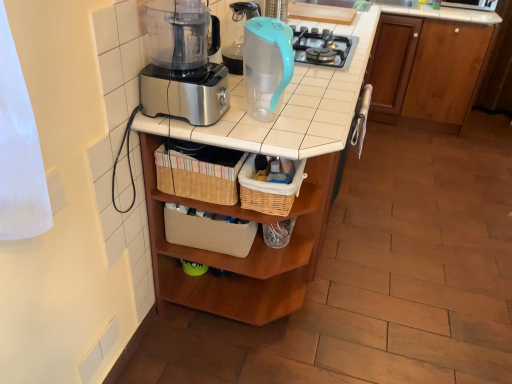
Question: Considering the relative sizes of woven straw basket at center, arranged as the second basket when viewed from the right, and teal plastic pitcher at upper center in the image provided, is woven straw basket at center, arranged as the second basket when viewed from the right, shorter than teal plastic pitcher at upper center?

Choices:
 (A) yes
 (B) no

Answer: (A)

Question: Considering the relative positions of woven straw basket at center, arranged as the second basket when viewed from the right, and teal plastic pitcher at upper center in the image provided, is woven straw basket at center, arranged as the second basket when viewed from the right, behind teal plastic pitcher at upper center?

Choices:
 (A) no
 (B) yes

Answer: (B)

Question: Considering the relative positions of woven straw basket at center, the first basket from the left, and teal plastic pitcher at upper center in the image provided, is woven straw basket at center, the first basket from the left, to the right of teal plastic pitcher at upper center from the viewer's perspective?

Choices:
 (A) no
 (B) yes

Answer: (A)

Question: From the image's perspective, would you say woven straw basket at center, arranged as the second basket when viewed from the right, is shown under teal plastic pitcher at upper center?

Choices:
 (A) no
 (B) yes

Answer: (B)

Question: Is woven straw basket at center, arranged as the second basket when viewed from the right, taller than teal plastic pitcher at upper center?

Choices:
 (A) yes
 (B) no

Answer: (B)

Question: From the image's perspective, is brown wood cabinet at upper right under woven straw basket at center, the first basket from the left?

Choices:
 (A) no
 (B) yes

Answer: (A)

Question: Considering the relative sizes of brown wood cabinet at upper right and woven straw basket at center, arranged as the second basket when viewed from the right, in the image provided, is brown wood cabinet at upper right smaller than woven straw basket at center, arranged as the second basket when viewed from the right,?

Choices:
 (A) no
 (B) yes

Answer: (A)

Question: Is brown wood cabinet at upper right in contact with woven straw basket at center, arranged as the second basket when viewed from the right?

Choices:
 (A) yes
 (B) no

Answer: (B)

Question: Considering the relative sizes of brown wood cabinet at upper right and woven straw basket at center, arranged as the second basket when viewed from the right, in the image provided, is brown wood cabinet at upper right bigger than woven straw basket at center, arranged as the second basket when viewed from the right,?

Choices:
 (A) no
 (B) yes

Answer: (B)

Question: Is brown wood cabinet at upper right wider than woven straw basket at center, arranged as the second basket when viewed from the right?

Choices:
 (A) yes
 (B) no

Answer: (A)

Question: Is the position of brown wood cabinet at upper right more distant than that of woven straw basket at center, arranged as the second basket when viewed from the right?

Choices:
 (A) yes
 (B) no

Answer: (A)

Question: Is teal plastic pitcher at upper center completely or partially outside of wooden table at center?

Choices:
 (A) yes
 (B) no

Answer: (A)